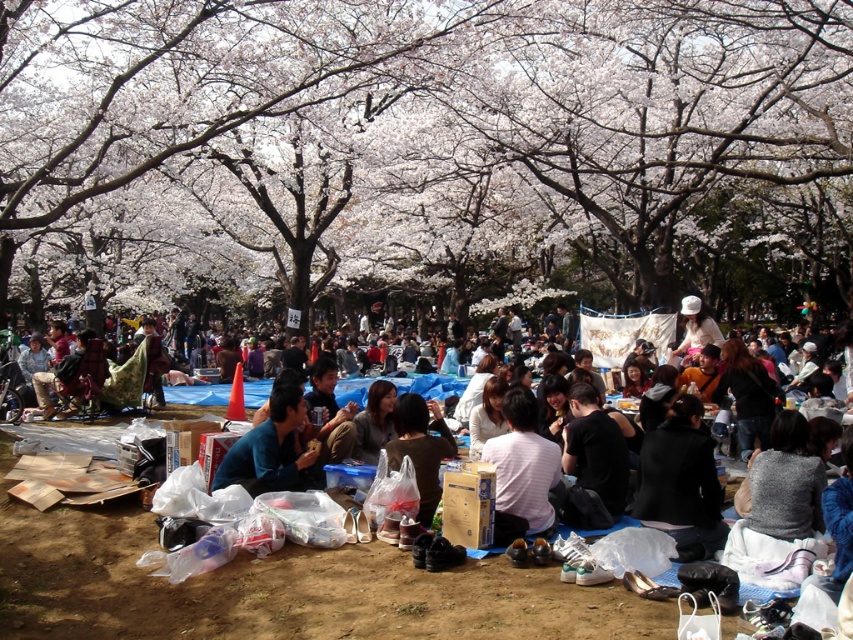
Question: Which point appears farthest from the camera in this image?

Choices:
 (A) (279, 440)
 (B) (514, 483)

Answer: (A)

Question: Estimate the real-world distances between objects in this image. Which object is farther from the blue fabric at center?

Choices:
 (A) white blossoms at center
 (B) striped cotton shirt at center

Answer: (A)

Question: Does white blossoms at center have a greater width compared to striped cotton shirt at center?

Choices:
 (A) no
 (B) yes

Answer: (B)

Question: Does white blossoms at center have a greater width compared to striped cotton shirt at center?

Choices:
 (A) yes
 (B) no

Answer: (A)

Question: Which object is closer to the camera taking this photo?

Choices:
 (A) blue fabric at center
 (B) white blossoms at center
 (C) striped cotton shirt at center

Answer: (C)

Question: Is striped cotton shirt at center bigger than blue fabric at center?

Choices:
 (A) yes
 (B) no

Answer: (B)